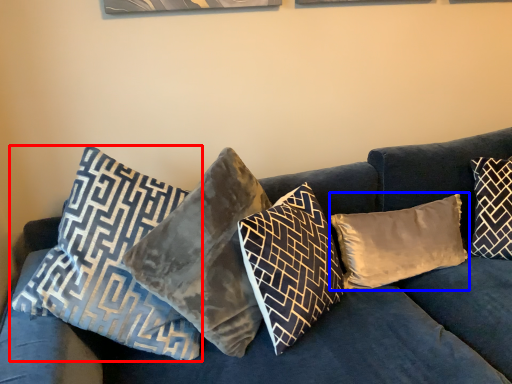
Question: Among these objects, which one is farthest to the camera, pillow (highlighted by a red box) or pillow (highlighted by a blue box)?

Choices:
 (A) pillow
 (B) pillow

Answer: (B)